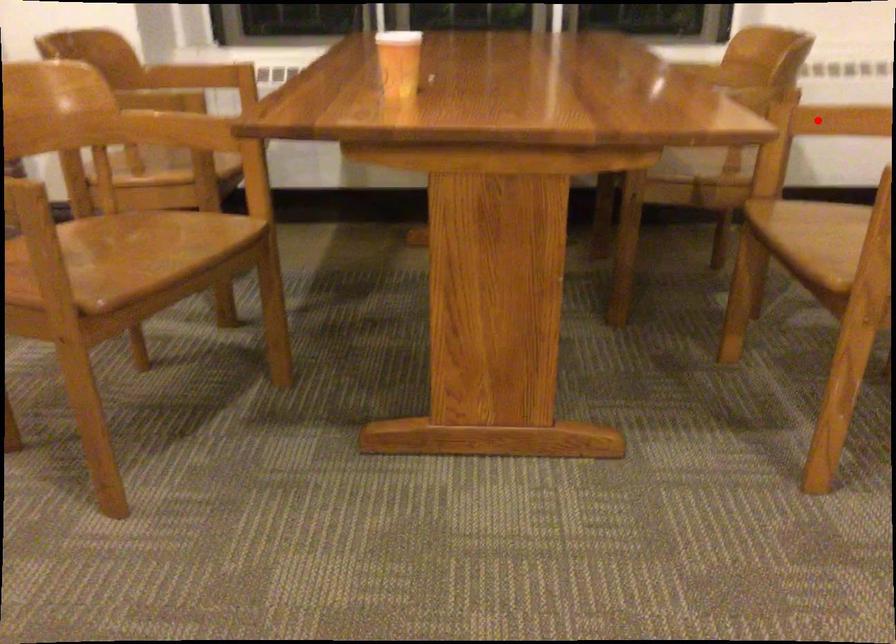
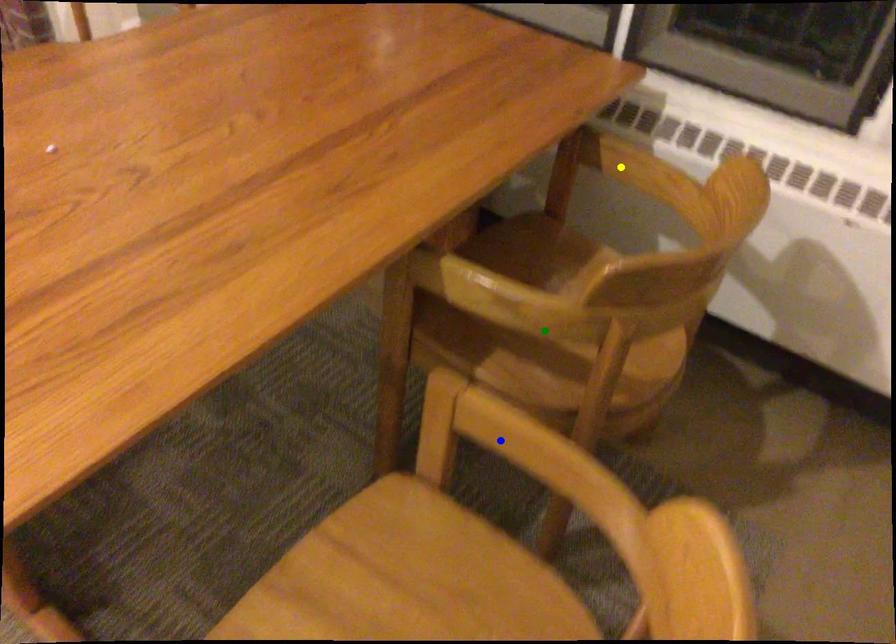
Question: I am providing you with two images of the same scene from different viewpoints. A red point is marked on the first image. You are given multiple points on the second image. In image 2, which mark is for the same physical point as the one in image 1?

Choices:
 (A) blue point
 (B) yellow point
 (C) green point

Answer: (A)